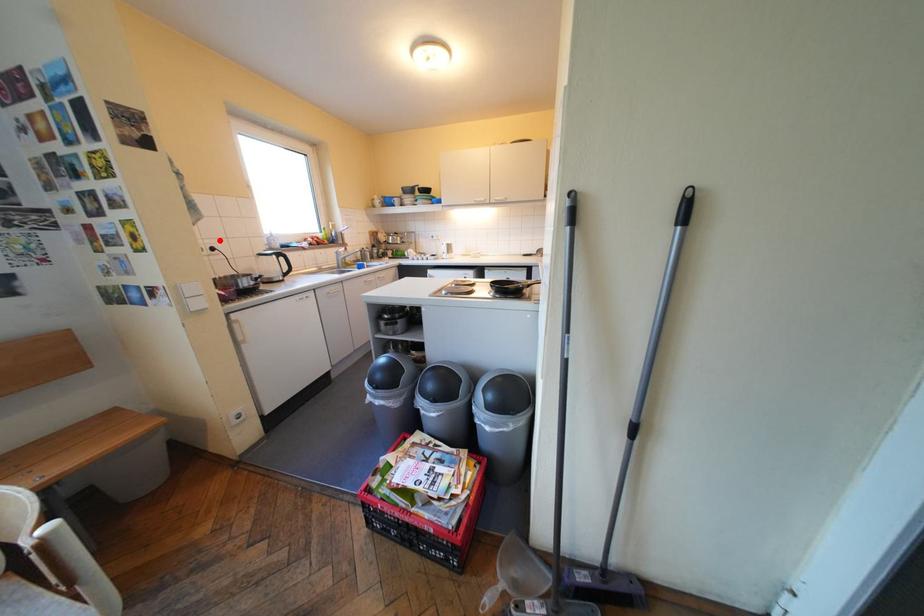
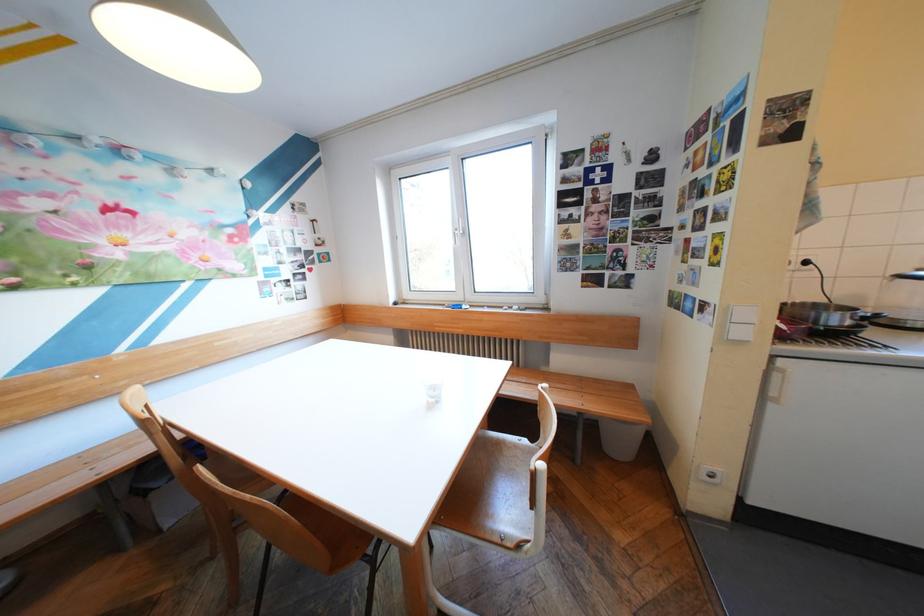
Question: I am providing you with two images of the same scene from different viewpoints. In image1, a red point is highlighted. Considering the same 3D point in image2, which of the following is correct?

Choices:
 (A) It is closer
 (B) It is farther

Answer: (B)